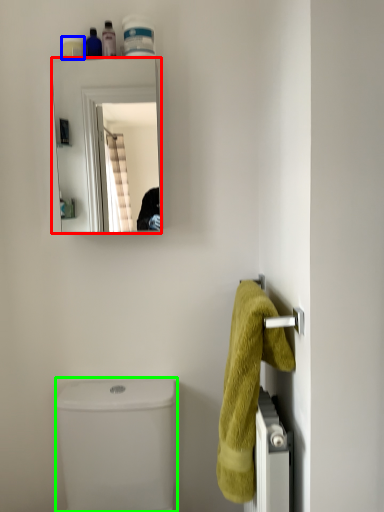
Question: Estimate the real-world distances between objects in this image. Which object is closer to mirror (highlighted by a red box), toiletry (highlighted by a blue box) or toilet bowl (highlighted by a green box)?

Choices:
 (A) toiletry
 (B) toilet bowl

Answer: (B)